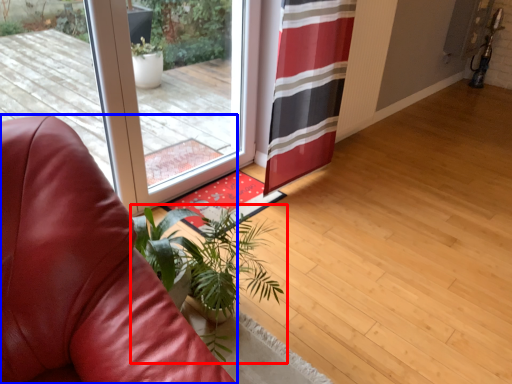
Question: Which point is further to the camera, houseplant (highlighted by a red box) or chair (highlighted by a blue box)?

Choices:
 (A) houseplant
 (B) chair

Answer: (A)